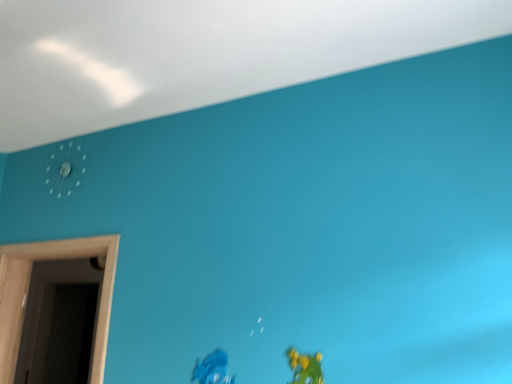
Question: From a real-world perspective, is white plastic clock at upper left under matte green toy at lower right, which is counted as the first toy, starting from the right?

Choices:
 (A) yes
 (B) no

Answer: (B)

Question: Is white plastic clock at upper left shorter than matte green toy at lower right, the second toy in the back-to-front sequence?

Choices:
 (A) yes
 (B) no

Answer: (B)

Question: Is matte green toy at lower right, the second toy in the back-to-front sequence, at the back of white plastic clock at upper left?

Choices:
 (A) yes
 (B) no

Answer: (B)

Question: From a real-world perspective, is white plastic clock at upper left on top of matte green toy at lower right, which is counted as the first toy, starting from the right?

Choices:
 (A) yes
 (B) no

Answer: (A)

Question: From the image's perspective, is white plastic clock at upper left over matte green toy at lower right, the first toy positioned from the front?

Choices:
 (A) yes
 (B) no

Answer: (A)

Question: Is matte green toy at lower right, the first toy positioned from the front, taller or shorter than wooden door at left?

Choices:
 (A) tall
 (B) short

Answer: (B)

Question: From a real-world perspective, is matte green toy at lower right, the first toy positioned from the front, above or below wooden door at left?

Choices:
 (A) above
 (B) below

Answer: (B)

Question: Looking at their shapes, would you say matte green toy at lower right, which is counted as the first toy, starting from the right, is wider or thinner than wooden door at left?

Choices:
 (A) wide
 (B) thin

Answer: (B)

Question: From the image's perspective, is matte green toy at lower right, the second toy in the back-to-front sequence, positioned above or below wooden door at left?

Choices:
 (A) below
 (B) above

Answer: (B)

Question: Relative to white plastic clock at upper left, is matte green toy at lower right, the second toy in the back-to-front sequence, in front or behind?

Choices:
 (A) behind
 (B) front

Answer: (B)

Question: From the image's perspective, is matte green toy at lower right, the second toy in the back-to-front sequence, above or below white plastic clock at upper left?

Choices:
 (A) below
 (B) above

Answer: (A)

Question: From a real-world perspective, is matte green toy at lower right, the first toy positioned from the front, physically located above or below white plastic clock at upper left?

Choices:
 (A) above
 (B) below

Answer: (B)

Question: Considering the positions of matte green toy at lower right, positioned as the 2th toy in left-to-right order, and white plastic clock at upper left in the image, is matte green toy at lower right, positioned as the 2th toy in left-to-right order, bigger or smaller than white plastic clock at upper left?

Choices:
 (A) small
 (B) big

Answer: (A)

Question: In terms of size, does wooden door at left appear bigger or smaller than matte blue toy at lower center, which is the first toy from left to right?

Choices:
 (A) big
 (B) small

Answer: (A)

Question: From a real-world perspective, is wooden door at left positioned above or below matte blue toy at lower center, the 2th toy when ordered from right to left?

Choices:
 (A) above
 (B) below

Answer: (A)